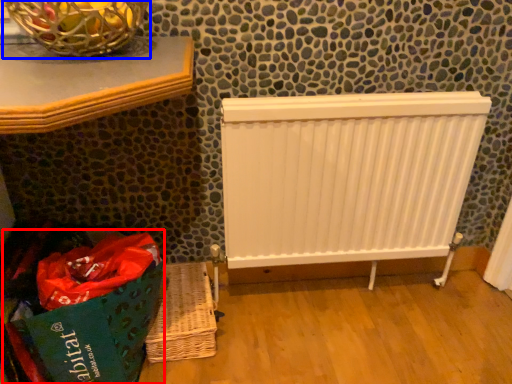
Question: Which point is further to the camera, shopping bag (highlighted by a red box) or basket container (highlighted by a blue box)?

Choices:
 (A) shopping bag
 (B) basket container

Answer: (A)